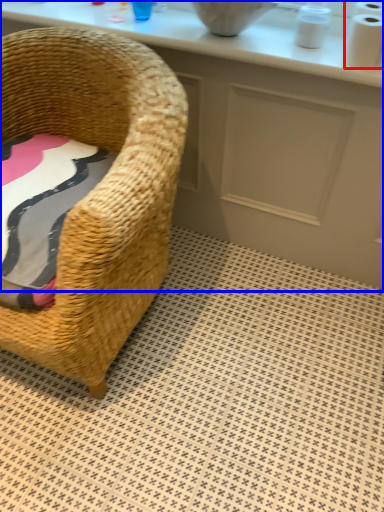
Question: Among these objects, which one is farthest to the camera, toilet paper (highlighted by a red box) or counter (highlighted by a blue box)?

Choices:
 (A) toilet paper
 (B) counter

Answer: (B)